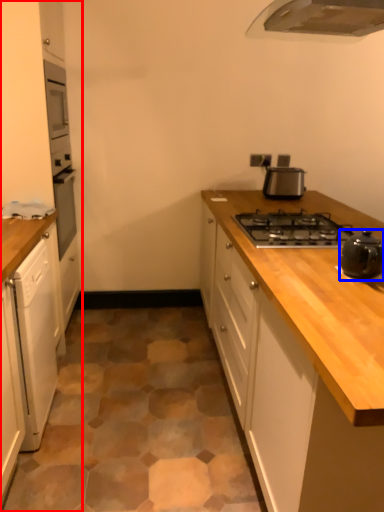
Question: Which point is closer to the camera, cabinetry (highlighted by a red box) or kitchen appliance (highlighted by a blue box)?

Choices:
 (A) cabinetry
 (B) kitchen appliance

Answer: (B)